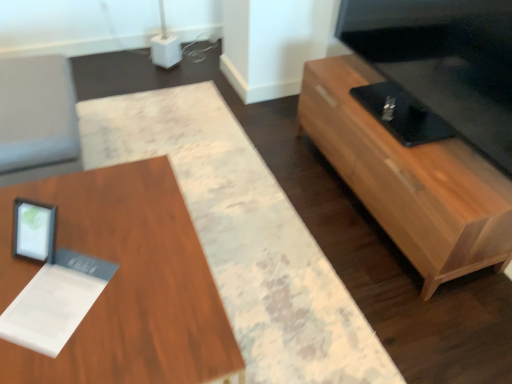
I want to click on empty space that is ontop of wooden table at center, which appears as the second table when viewed from the right (from a real-world perspective), so click(90, 267).